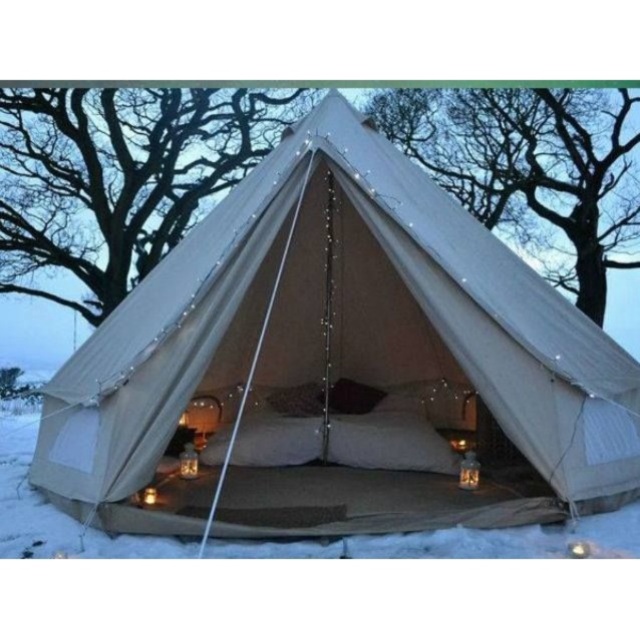
From the picture: Does beige canvas tent at center have a smaller size compared to white soft snow at center?

Correct, beige canvas tent at center occupies less space than white soft snow at center.

Does beige canvas tent at center lie behind white soft snow at center?

Yes, beige canvas tent at center is behind white soft snow at center.

Identify the location of beige canvas tent at center. (337, 364).